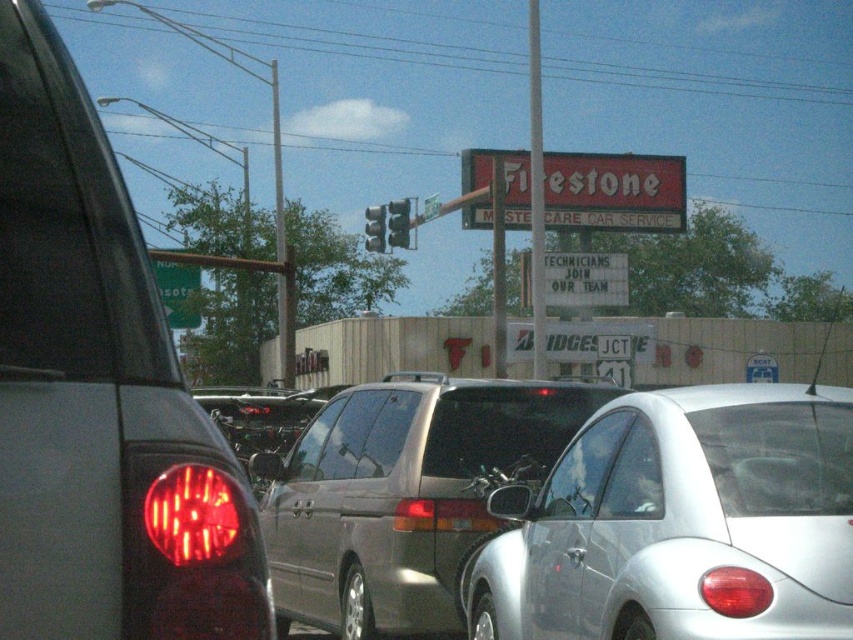
Describe the element at coordinates (682, 522) in the screenshot. I see `silver metallic car at center` at that location.

Is point (834, 497) positioned behind point (393, 204)?

No.

Where is `silver metallic car at center`? The image size is (853, 640). silver metallic car at center is located at coordinates (682, 522).

Who is lower down, satin silver van at center or metallic traffic light at center?

Positioned lower is satin silver van at center.

Which is in front, point (393, 467) or point (376, 246)?

Positioned in front is point (393, 467).

Where is `satin silver van at center`? This screenshot has width=853, height=640. satin silver van at center is located at coordinates coord(402,496).

Where is `matte black car at left`? The height and width of the screenshot is (640, 853). matte black car at left is located at coordinates (99, 394).

Is matte black car at left to the left of metallic silver traffic light at center from the viewer's perspective?

Incorrect, matte black car at left is not on the left side of metallic silver traffic light at center.

At what (x,y) coordinates should I click in order to perform the action: click on matte black car at left. Please return your answer as a coordinate pair (x, y). Looking at the image, I should click on (99, 394).

At what (x,y) coordinates should I click in order to perform the action: click on matte black car at left. Please return your answer as a coordinate pair (x, y). Looking at the image, I should click on (99, 394).